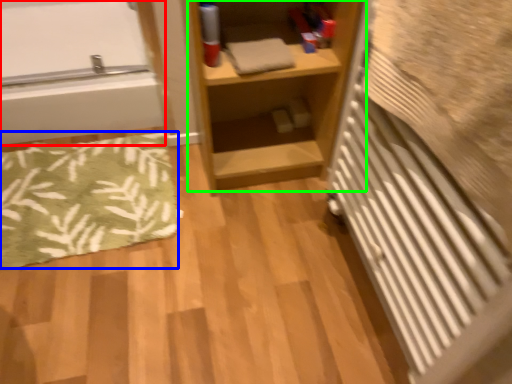
Question: Which object is positioned farthest from bathtub (highlighted by a red box)? Select from bath mat (highlighted by a blue box) and shelf (highlighted by a green box).

Choices:
 (A) bath mat
 (B) shelf

Answer: (B)